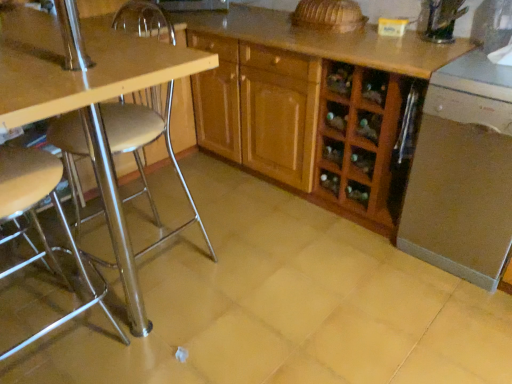
The width and height of the screenshot is (512, 384). Find the location of `free space to the right of metallic silver stool at left`. free space to the right of metallic silver stool at left is located at coordinates click(x=182, y=333).